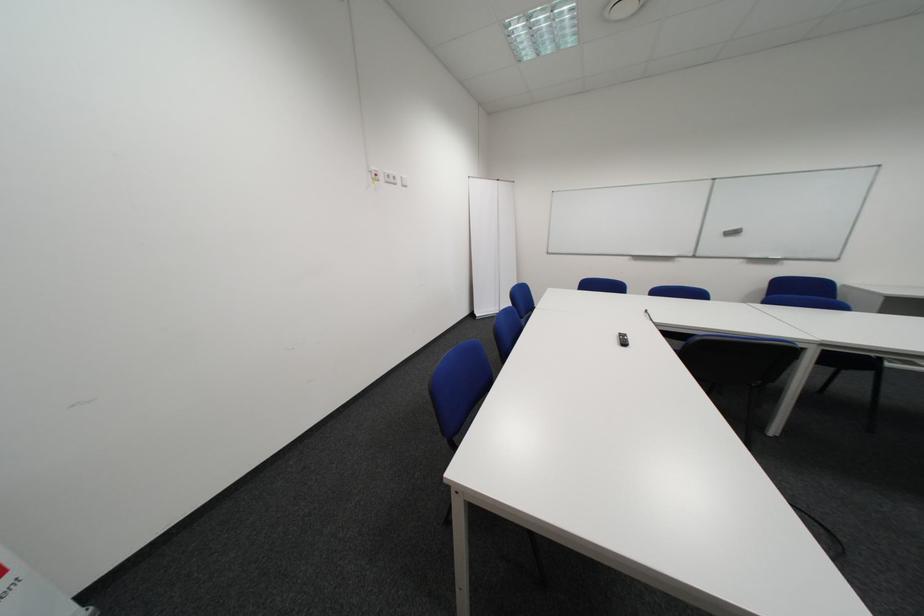
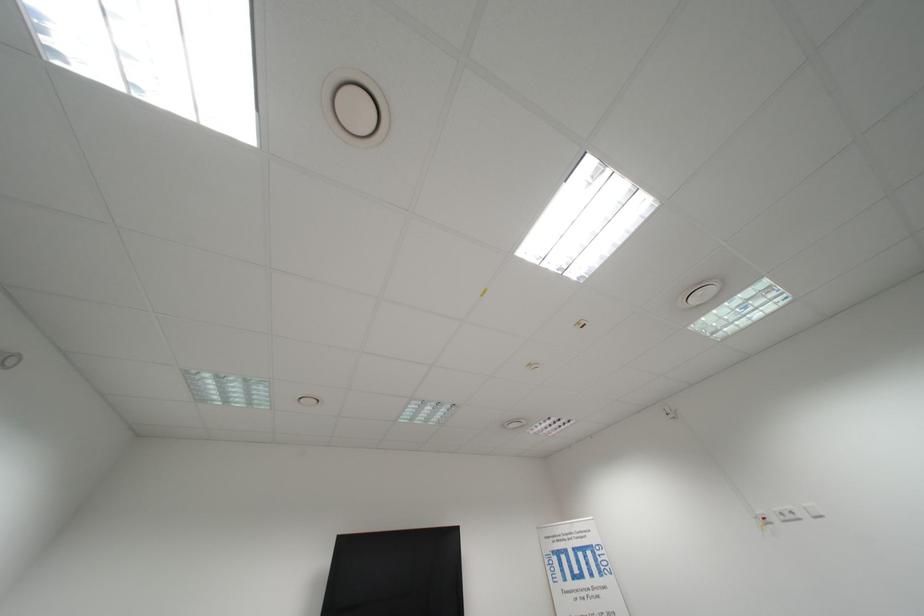
Where in the second image is the point corresponding to (x=398, y=180) from the first image?

(796, 519)